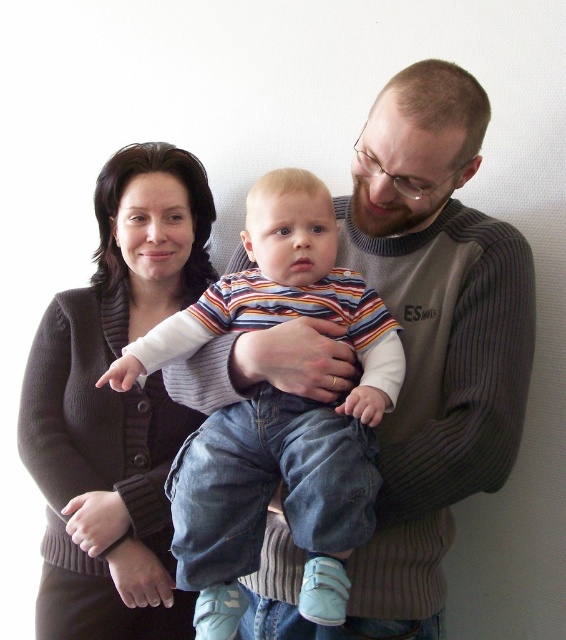
Who is more forward, (229, 531) or (54, 499)?

Point (229, 531)

Is striped cotton shirt at center thinner than dark brown sweater at center?

Incorrect, striped cotton shirt at center's width is not less than dark brown sweater at center's.

Is point (291, 280) behind point (162, 310)?

No, (291, 280) is in front of (162, 310).

Where is `striped cotton shirt at center`? The width and height of the screenshot is (566, 640). striped cotton shirt at center is located at coordinates (276, 413).